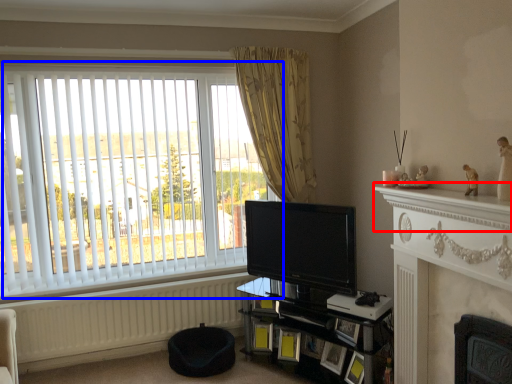
Question: Which of the following is the farthest to the observer, mantle (highlighted by a red box) or window (highlighted by a blue box)?

Choices:
 (A) mantle
 (B) window

Answer: (B)